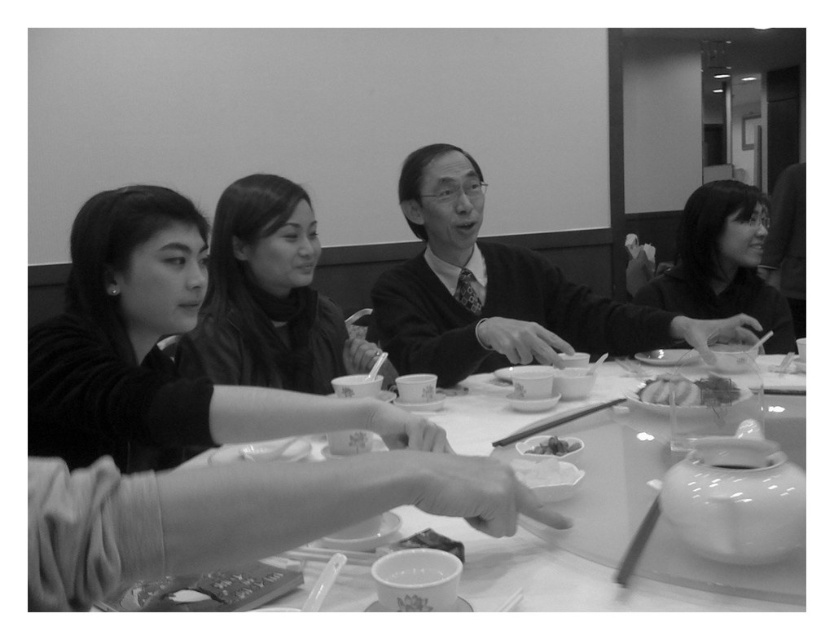
You are planning to place a rectangular gift box that is 1 meter long on the white glossy table at center. Considering the smooth black hair at center is also on the table, can the gift box fit on the table without overlapping the hair?

The white glossy table at center is wider than the smooth black hair at center. However, the gift box is 1 meter long, and there is no information provided about the table dimensions or the distance between the hair and the table edges. Therefore, it is uncertain if the gift box can fit without overlapping the hair.

You are sitting at the table and want to reach for the smooth black hair at center. Considering the white glossy table at center is in the way, can you directly touch it without moving the table?

The white glossy table at center is closer to the viewer than the smooth black hair at center, so you cannot directly touch the smooth black hair at center without moving the table because the table is blocking the path.

Consider the image. You are a photographer trying to capture a closeup of the white glossy table at center without including the knitted sweater at center in the frame. Based on their sizes, is this possible?

The knitted sweater at center is taller than the white glossy table at center, so it might be challenging to capture a closeup of the white glossy table at center without including the knitted sweater at center in the frame due to its height.